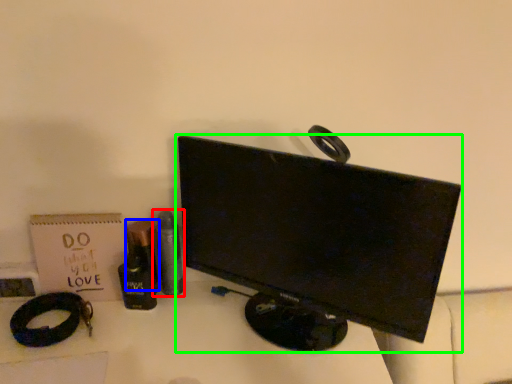
Question: Which object is the farthest from toiletry (highlighted by a red box)? Choose among these: toiletry (highlighted by a blue box) or computer monitor (highlighted by a green box).

Choices:
 (A) toiletry
 (B) computer monitor

Answer: (B)